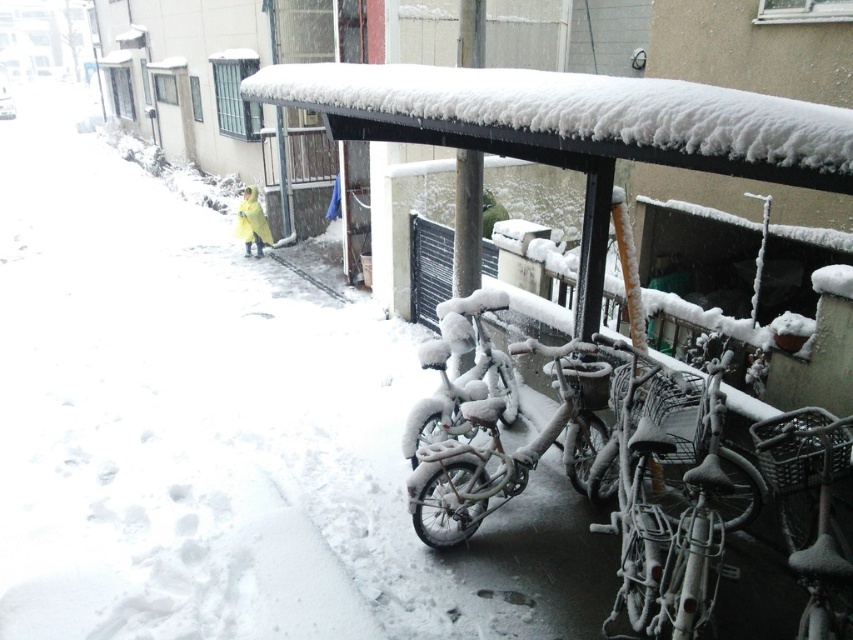
Is point (624, 436) more distant than point (508, 358)?

No, (624, 436) is closer to viewer.

Which is above, white matte bicycle at lower right or frosted metallic bicycle at center?

Positioned higher is frosted metallic bicycle at center.

Who is more distant from viewer, (674, 396) or (456, 336)?

Point (456, 336)

Locate an element on the screen. white matte bicycle at lower right is located at coordinates pos(659,504).

Which is more to the left, snow-covered metal bicycle at center or frosted metallic bicycle at center?

frosted metallic bicycle at center is more to the left.

Can you confirm if snow-covered metal bicycle at center is positioned to the left of frosted metallic bicycle at center?

Incorrect, snow-covered metal bicycle at center is not on the left side of frosted metallic bicycle at center.

Who is more distant from viewer, (x=544, y=433) or (x=431, y=401)?

Point (x=431, y=401)

Where is `snow-covered metal bicycle at center`? snow-covered metal bicycle at center is located at coordinates (506, 452).

Is metallic silver bicycle at lower right closer to the viewer compared to frosted metallic bicycle at center?

Yes, it is in front of frosted metallic bicycle at center.

Which is more to the left, metallic silver bicycle at lower right or frosted metallic bicycle at center?

frosted metallic bicycle at center

Is point (822, 506) closer to camera compared to point (495, 292)?

Yes, point (822, 506) is in front of point (495, 292).

What are the coordinates of `metallic silver bicycle at lower right` in the screenshot? It's located at coord(815,502).